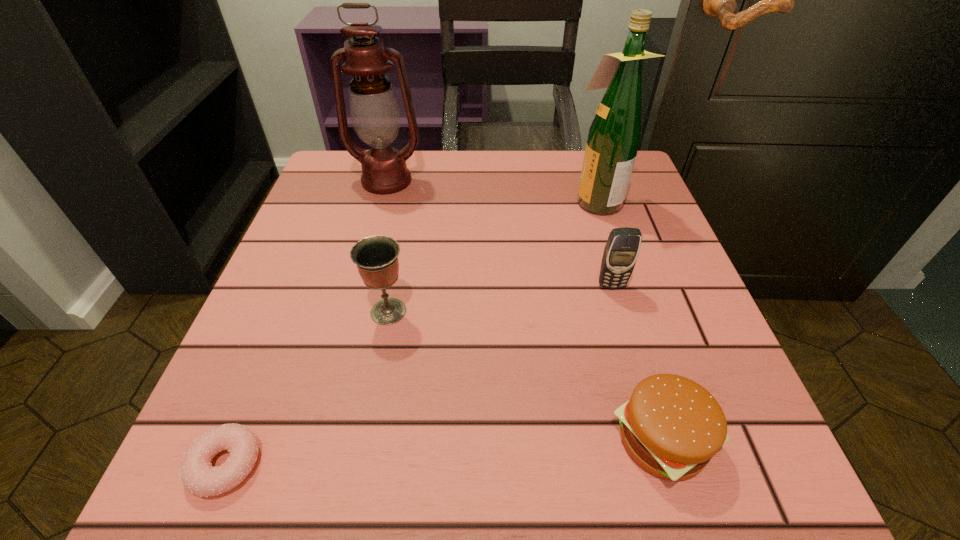
Identify the location of blank space at the right edge of the desktop. The width and height of the screenshot is (960, 540). (648, 328).

Find the location of a particular element. The image size is (960, 540). vacant space at the far left corner is located at coordinates (355, 171).

Identify the location of free space between the hamburger and the liquor. The width and height of the screenshot is (960, 540). (629, 320).

Where is `free point between the third nearest object and the liquor`? Image resolution: width=960 pixels, height=540 pixels. free point between the third nearest object and the liquor is located at coordinates (492, 256).

The width and height of the screenshot is (960, 540). What are the coordinates of `vacant region between the fifth tallest object and the doughnut` in the screenshot? It's located at (444, 452).

Image resolution: width=960 pixels, height=540 pixels. I want to click on vacant area that lies between the chalice and the shortest object, so click(x=307, y=388).

Where is `vacant space that's between the cellular telephone and the liquor`? The height and width of the screenshot is (540, 960). vacant space that's between the cellular telephone and the liquor is located at coordinates (604, 243).

Locate an element on the screen. This screenshot has height=540, width=960. vacant area that lies between the chalice and the fourth nearest object is located at coordinates (500, 299).

You are a GUI agent. You are given a task and a screenshot of the screen. Output one action in this format:
    pyautogui.click(x=<x>, y=<y>)
    Task: Click on the empty location between the cellular telephone and the oil lamp
    This screenshot has height=540, width=960.
    Given the screenshot: What is the action you would take?
    pyautogui.click(x=499, y=233)

You are a GUI agent. You are given a task and a screenshot of the screen. Output one action in this format:
    pyautogui.click(x=<x>, y=<y>)
    Task: Click on the vacant region between the cellular telephone and the liquor
    This screenshot has height=540, width=960.
    Given the screenshot: What is the action you would take?
    pyautogui.click(x=604, y=243)